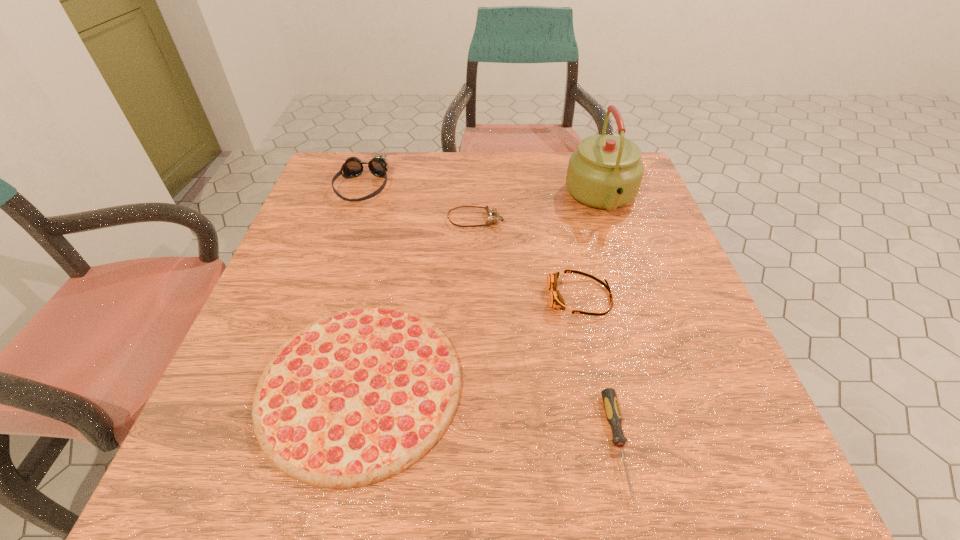
The width and height of the screenshot is (960, 540). What are the coordinates of `goggles that is at the left edge` in the screenshot? It's located at (353, 167).

Locate an element on the screen. The height and width of the screenshot is (540, 960). pizza that is at the left edge is located at coordinates (357, 396).

Locate an element on the screen. Image resolution: width=960 pixels, height=540 pixels. object situated at the right edge is located at coordinates (605, 172).

Where is `object that is at the far left corner`? object that is at the far left corner is located at coordinates (353, 167).

This screenshot has width=960, height=540. I want to click on object present at the near left corner, so click(357, 396).

Identify the location of object at the far right corner. (605, 172).

The height and width of the screenshot is (540, 960). Find the location of `blank space at the far edge of the desktop`. blank space at the far edge of the desktop is located at coordinates (521, 154).

You are a GUI agent. You are given a task and a screenshot of the screen. Output one action in this format:
    pyautogui.click(x=<x>, y=<y>)
    Task: Click on the vacant space at the left edge of the desktop
    The height and width of the screenshot is (540, 960).
    Given the screenshot: What is the action you would take?
    pyautogui.click(x=303, y=291)

Locate an element on the screen. The image size is (960, 540). free space at the right edge is located at coordinates (648, 285).

Locate an element on the screen. vacant space at the far left corner of the desktop is located at coordinates (324, 179).